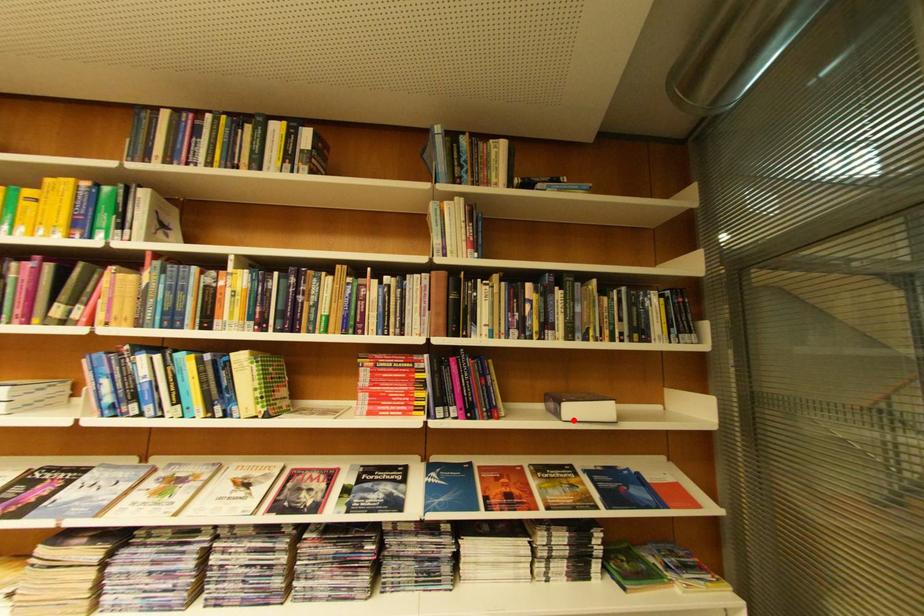
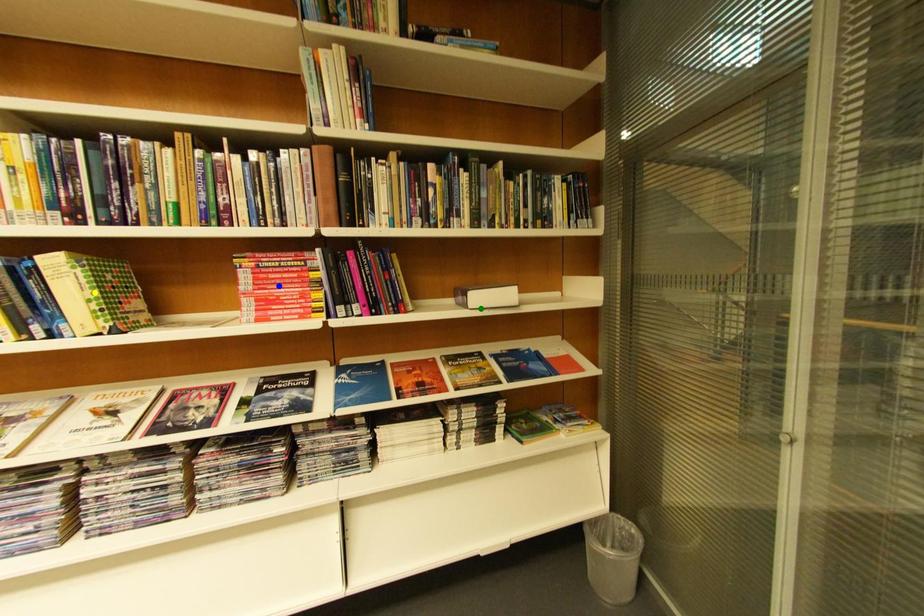
Question: I am providing you with two images of the same scene from different viewpoints. A red point is marked on the first image. You are given multiple points on the second image. Which mark in image 2 goes with the point in image 1?

Choices:
 (A) green point
 (B) blue point
 (C) yellow point

Answer: (A)